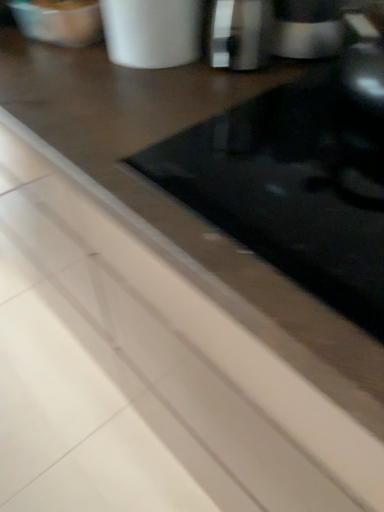
Question: Is metallic silver cup at upper center taller or shorter than sleek silver coffee machine at upper right?

Choices:
 (A) tall
 (B) short

Answer: (A)

Question: Which is correct: metallic silver cup at upper center is inside sleek silver coffee machine at upper right, or outside of it?

Choices:
 (A) inside
 (B) outside

Answer: (B)

Question: Considering their positions, is metallic silver cup at upper center located in front of or behind sleek silver coffee machine at upper right?

Choices:
 (A) front
 (B) behind

Answer: (A)

Question: Considering the relative positions of sleek silver coffee machine at upper right and metallic silver cup at upper center in the image provided, is sleek silver coffee machine at upper right to the left or to the right of metallic silver cup at upper center?

Choices:
 (A) left
 (B) right

Answer: (B)

Question: In terms of width, does sleek silver coffee machine at upper right look wider or thinner when compared to metallic silver cup at upper center?

Choices:
 (A) wide
 (B) thin

Answer: (B)

Question: Is point (233, 17) closer or farther from the camera than point (167, 24)?

Choices:
 (A) closer
 (B) farther

Answer: (A)

Question: From a real-world perspective, is sleek silver coffee machine at upper right above or below metallic silver cup at upper center?

Choices:
 (A) below
 (B) above

Answer: (A)